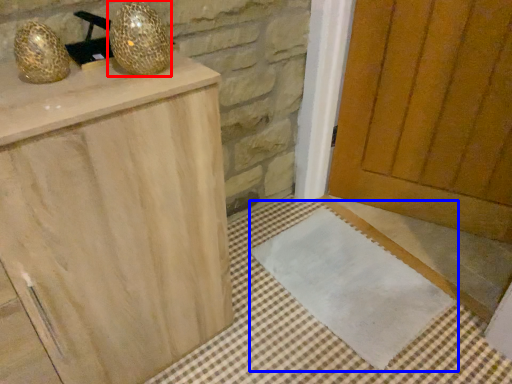
Question: Which object is closer to the camera taking this photo, disco ball (highlighted by a red box) or doormat (highlighted by a blue box)?

Choices:
 (A) disco ball
 (B) doormat

Answer: (A)